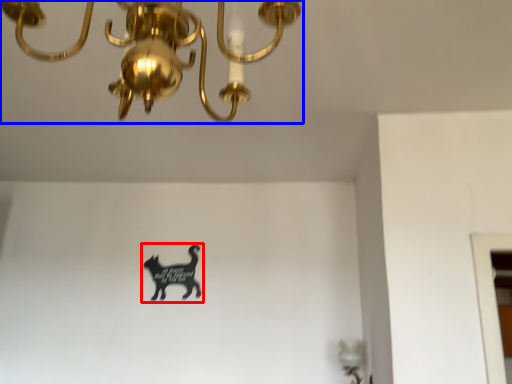
Question: Among these objects, which one is nearest to the camera, animal (highlighted by a red box) or lamp (highlighted by a blue box)?

Choices:
 (A) animal
 (B) lamp

Answer: (B)